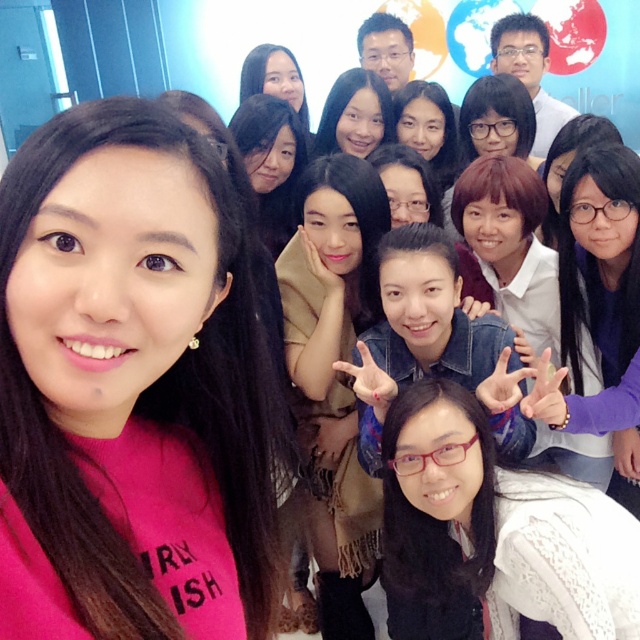
Question: Is the position of pink fabric at center more distant than that of matte black hair at upper center?

Choices:
 (A) yes
 (B) no

Answer: (B)

Question: Estimate the real-world distances between objects in this image. Which object is closer to the purple matte sweater at lower right?

Choices:
 (A) matte black hair at upper center
 (B) matte brown hair at center

Answer: (B)

Question: Does pink fabric at center appear over purple matte sweater at lower right?

Choices:
 (A) yes
 (B) no

Answer: (A)

Question: Does pink fabric at center have a larger size compared to purple matte sweater at lower right?

Choices:
 (A) yes
 (B) no

Answer: (B)

Question: Estimate the real-world distances between objects in this image. Which object is closer to the clear plastic glasses at center?

Choices:
 (A) pink fabric at center
 (B) matte black hair at upper center

Answer: (A)

Question: Among these objects, which one is farthest from the camera?

Choices:
 (A) clear plastic glasses at center
 (B) tan scarf at center
 (C) matte black glasses at center
 (D) pink fabric at center

Answer: (C)